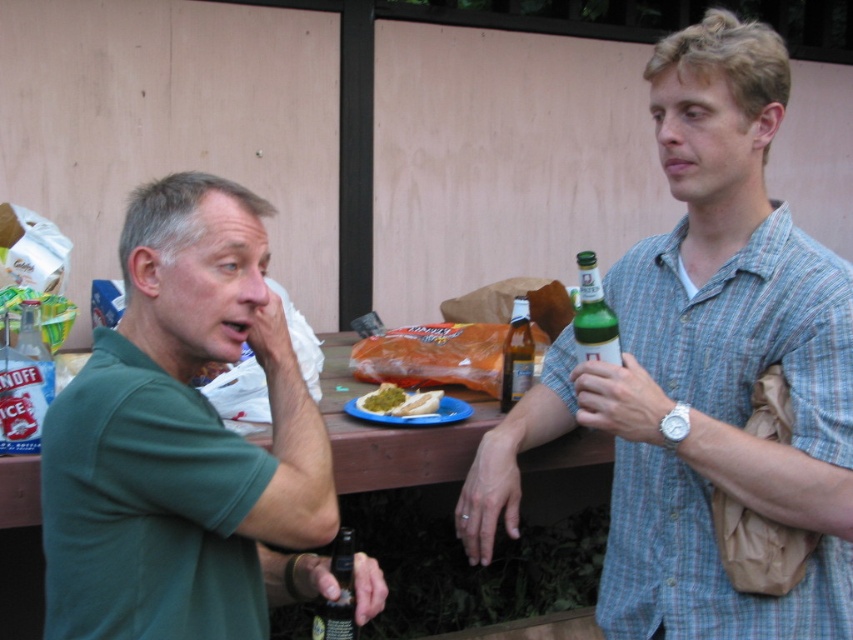
Question: Is green cotton shirt at center to the right of green glass bottle at right from the viewer's perspective?

Choices:
 (A) no
 (B) yes

Answer: (B)

Question: Estimate the real-world distances between objects in this image. Which object is farther from the green glass bottle at right?

Choices:
 (A) green mustard spread on bread at center
 (B) green cotton shirt at center
 (C) black glass beer bottle at lower left

Answer: (C)

Question: Which object appears closest to the camera in this image?

Choices:
 (A) green matte shirt at left
 (B) green cotton shirt at center

Answer: (A)

Question: Does brown wood table at center have a larger size compared to green glass bottle at right?

Choices:
 (A) no
 (B) yes

Answer: (B)

Question: Can you confirm if black glass beer bottle at lower left is wider than green mustard spread on bread at center?

Choices:
 (A) yes
 (B) no

Answer: (B)

Question: Which object is closer to the camera taking this photo?

Choices:
 (A) green glass bottle at center
 (B) black glass beer bottle at lower left
 (C) green glass bottle at right

Answer: (C)